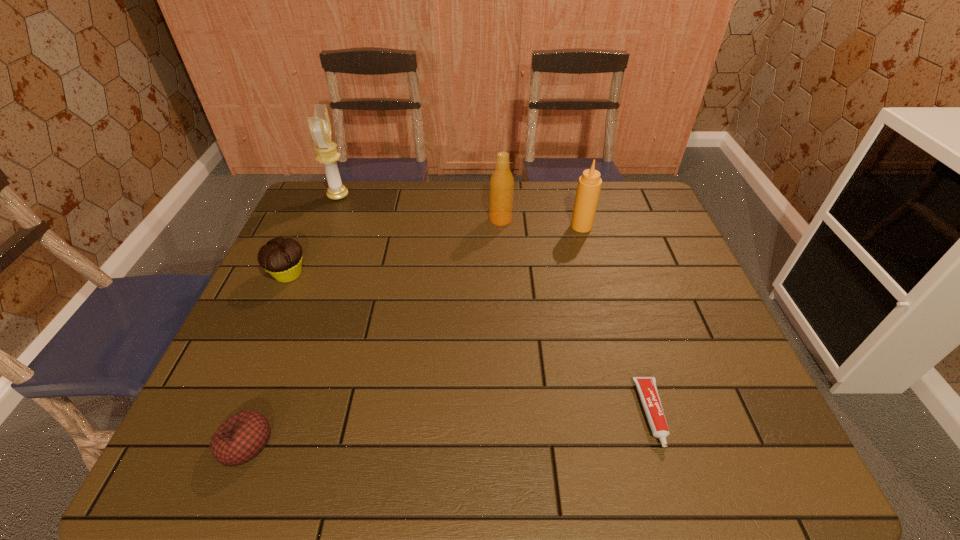
The width and height of the screenshot is (960, 540). Identify the location of beanbag at the left edge. (241, 437).

This screenshot has height=540, width=960. In order to click on object present at the far left corner in this screenshot , I will do `click(320, 127)`.

Locate an element on the screen. object situated at the near left corner is located at coordinates (241, 437).

I want to click on free space at the far edge of the desktop, so click(x=437, y=184).

In the image, there is a desktop. Identify the location of vacant space at the near edge. (665, 456).

Find the location of `free space at the left edge of the desktop`. free space at the left edge of the desktop is located at coordinates (335, 248).

The width and height of the screenshot is (960, 540). Identify the location of vacant space at the right edge of the desktop. (768, 427).

Identify the location of vacant space at the far right corner of the desktop. (657, 201).

This screenshot has height=540, width=960. Find the location of `free space that is in between the award and the toothpaste`. free space that is in between the award and the toothpaste is located at coordinates (495, 305).

Where is `free area in between the fourth tallest object and the condiment`? The width and height of the screenshot is (960, 540). free area in between the fourth tallest object and the condiment is located at coordinates click(435, 251).